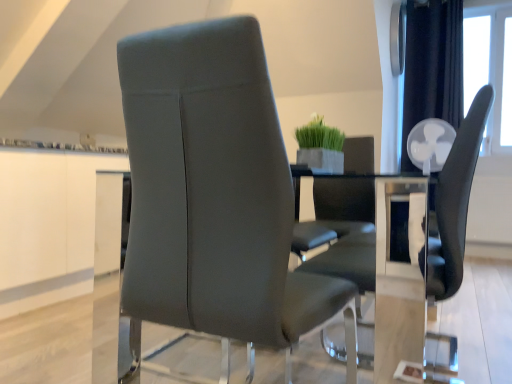
Question: Should I look upward or downward to see satin gray leather chair at center, the first chair viewed from the left?

Choices:
 (A) down
 (B) up

Answer: (A)

Question: Can we say clear glass table at center lies outside satin gray leather chair at center, the 2th chair when ordered from right to left?

Choices:
 (A) yes
 (B) no

Answer: (A)

Question: From a real-world perspective, is clear glass table at center on top of satin gray leather chair at center, the first chair viewed from the left?

Choices:
 (A) yes
 (B) no

Answer: (B)

Question: Could you tell me if clear glass table at center is turned towards satin gray leather chair at center, the 2th chair when ordered from right to left?

Choices:
 (A) no
 (B) yes

Answer: (A)

Question: Does clear glass table at center have a greater width compared to satin gray leather chair at center, the first chair viewed from the left?

Choices:
 (A) yes
 (B) no

Answer: (A)

Question: Can you confirm if clear glass table at center is positioned to the left of satin gray leather chair at center, the first chair viewed from the left?

Choices:
 (A) no
 (B) yes

Answer: (A)

Question: Is clear glass table at center far away from satin gray leather chair at center, the 2th chair when ordered from right to left?

Choices:
 (A) no
 (B) yes

Answer: (A)

Question: From a real-world perspective, is satin gray leather chair at center, the first chair viewed from the left, beneath matte black chair at center, placed as the 2th chair when sorted from left to right?

Choices:
 (A) yes
 (B) no

Answer: (B)

Question: Is satin gray leather chair at center, the first chair viewed from the left, not inside matte black chair at center, placed as the 2th chair when sorted from left to right?

Choices:
 (A) yes
 (B) no

Answer: (A)

Question: From the image's perspective, is satin gray leather chair at center, the 2th chair when ordered from right to left, on top of matte black chair at center, marked as the 1th chair in a right-to-left arrangement?

Choices:
 (A) yes
 (B) no

Answer: (A)

Question: Considering the relative sizes of satin gray leather chair at center, the first chair viewed from the left, and matte black chair at center, marked as the 1th chair in a right-to-left arrangement, in the image provided, is satin gray leather chair at center, the first chair viewed from the left, bigger than matte black chair at center, marked as the 1th chair in a right-to-left arrangement,?

Choices:
 (A) yes
 (B) no

Answer: (B)

Question: Considering the relative positions of satin gray leather chair at center, the first chair viewed from the left, and matte black chair at center, marked as the 1th chair in a right-to-left arrangement, in the image provided, is satin gray leather chair at center, the first chair viewed from the left, to the right of matte black chair at center, marked as the 1th chair in a right-to-left arrangement, from the viewer's perspective?

Choices:
 (A) yes
 (B) no

Answer: (B)

Question: Could you tell me if satin gray leather chair at center, the 2th chair when ordered from right to left, is facing matte black chair at center, marked as the 1th chair in a right-to-left arrangement?

Choices:
 (A) yes
 (B) no

Answer: (A)

Question: Considering the relative sizes of satin gray leather chair at center, the first chair viewed from the left, and clear glass table at center in the image provided, is satin gray leather chair at center, the first chair viewed from the left, wider than clear glass table at center?

Choices:
 (A) no
 (B) yes

Answer: (A)